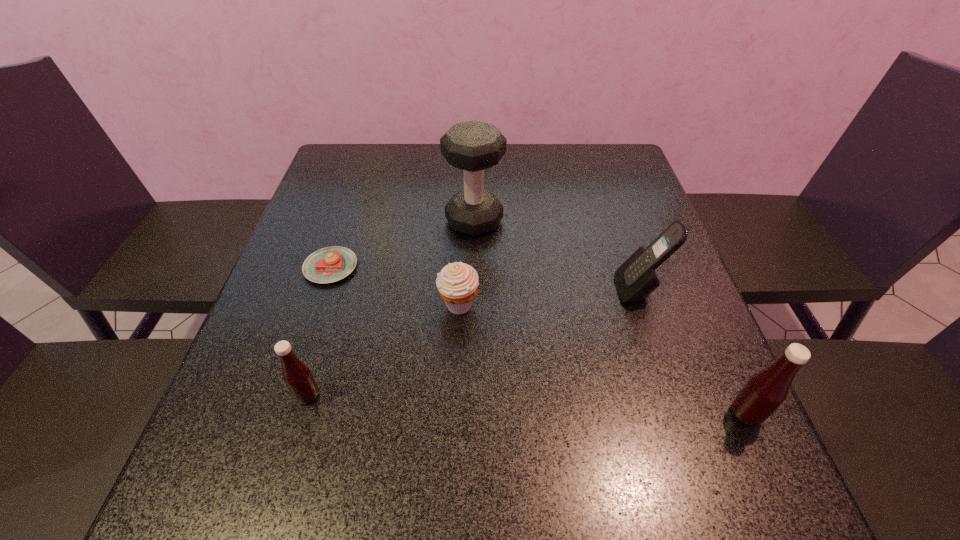
Image resolution: width=960 pixels, height=540 pixels. I want to click on cellular telephone at the right edge, so click(x=636, y=278).

The height and width of the screenshot is (540, 960). I want to click on object located in the near left corner section of the desktop, so click(297, 376).

Identify the location of object present at the near right corner. (766, 390).

Locate an element on the screen. vacant region at the far edge of the desktop is located at coordinates click(x=407, y=145).

Locate an element on the screen. This screenshot has width=960, height=540. vacant space at the near edge of the desktop is located at coordinates (507, 407).

I want to click on vacant point at the left edge, so click(x=278, y=381).

Find the location of `vacant space at the right edge of the desktop`. vacant space at the right edge of the desktop is located at coordinates (593, 193).

Locate an element on the screen. Image resolution: width=960 pixels, height=540 pixels. blank space at the far left corner is located at coordinates (353, 162).

In the image, there is a desktop. Find the location of `free space at the near right corner`. free space at the near right corner is located at coordinates (723, 411).

Locate an element on the screen. Image resolution: width=960 pixels, height=540 pixels. free space between the pastry and the third shortest object is located at coordinates (320, 331).